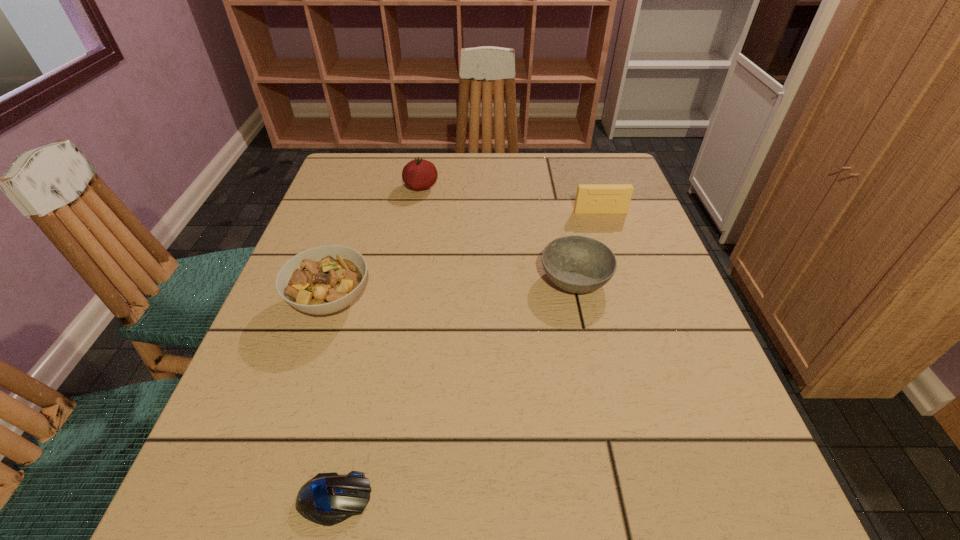
Locate an element on the screen. free point located 0.220m on the button side of the shortest object is located at coordinates (531, 499).

The width and height of the screenshot is (960, 540). Identify the location of object that is at the far edge. (419, 174).

Locate an element on the screen. object positioned at the near edge is located at coordinates (327, 499).

Find the location of a particular element. Image resolution: width=960 pixels, height=540 pixels. stew present at the left edge is located at coordinates (325, 279).

Find the location of a particular element. computer mouse that is at the left edge is located at coordinates (327, 499).

The image size is (960, 540). Find the location of `videotape present at the right edge`. videotape present at the right edge is located at coordinates (591, 198).

Image resolution: width=960 pixels, height=540 pixels. Find the location of `bowl situated at the right edge`. bowl situated at the right edge is located at coordinates (577, 264).

Where is `object that is at the near left corner`? This screenshot has width=960, height=540. object that is at the near left corner is located at coordinates (327, 499).

You are a GUI agent. You are given a task and a screenshot of the screen. Output one action in this format:
    pyautogui.click(x=<x>, y=<y>)
    Task: Click on the vacant space at the far edge of the desktop
    This screenshot has width=960, height=540.
    Given the screenshot: What is the action you would take?
    pos(438,163)

Locate an element on the screen. free space at the near edge of the desktop is located at coordinates (374, 498).